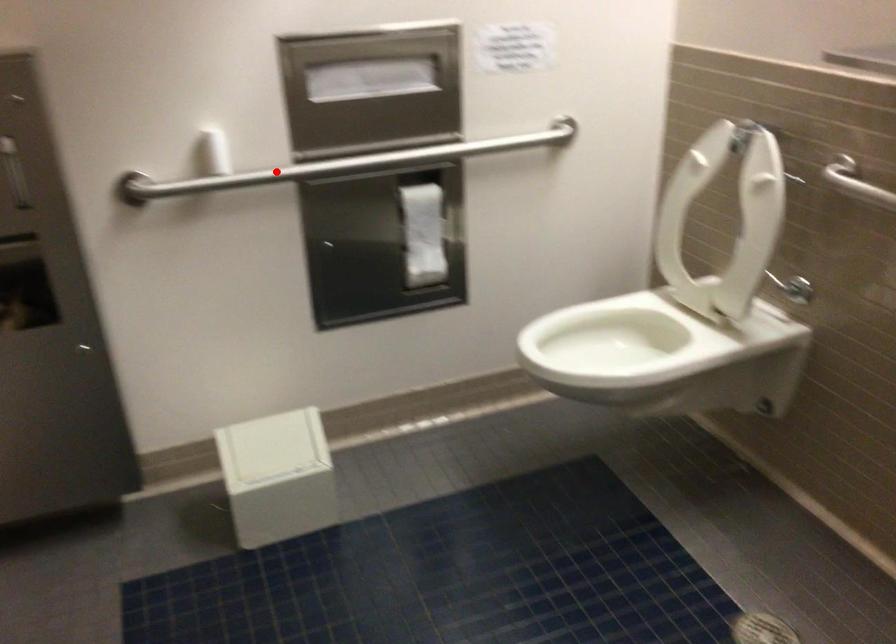
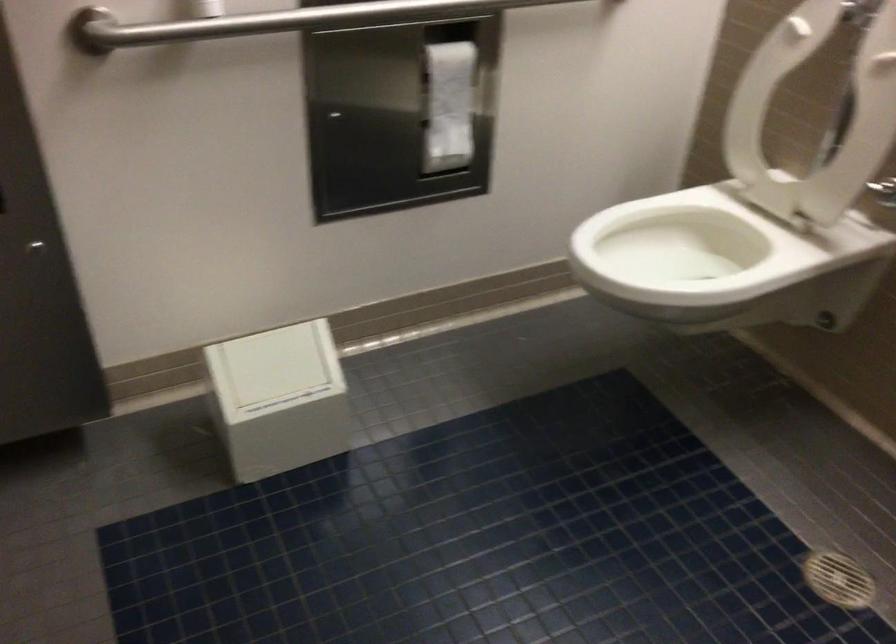
Find the pixel in the second image that matches the highlighted location in the first image.

(279, 21)